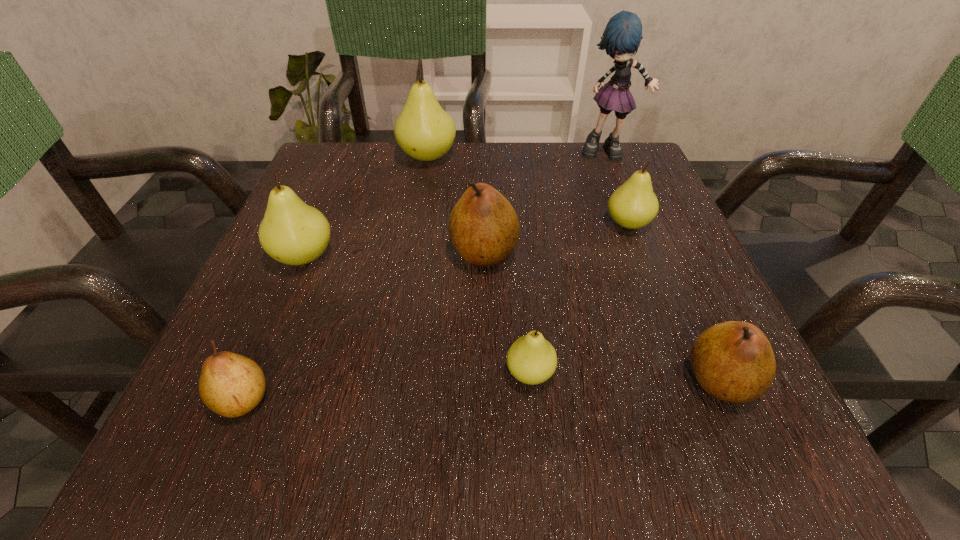
You are a GUI agent. You are given a task and a screenshot of the screen. Output one action in this format:
    pyautogui.click(x=<x>, y=<y>)
    Task: Click on the smallest green pear
    
    Given the screenshot: What is the action you would take?
    pyautogui.click(x=531, y=359)

Find the location of `the second green pear from right to left`. the second green pear from right to left is located at coordinates (531, 359).

The height and width of the screenshot is (540, 960). What are the coordinates of `vacant point located on the front-facing side of the blue rag doll` in the screenshot? It's located at (641, 230).

Locate an element on the screen. This screenshot has height=540, width=960. vacant space situated on the front of the biggest green pear is located at coordinates (413, 249).

You are a GUI agent. You are given a task and a screenshot of the screen. Output one action in this format:
    pyautogui.click(x=<x>, y=<y>)
    Task: Click on the free point located 0.090m on the front of the farthest brown pear
    The width and height of the screenshot is (960, 540).
    Given the screenshot: What is the action you would take?
    pyautogui.click(x=485, y=319)

Locate an element on the screen. The height and width of the screenshot is (540, 960). free spot located 0.180m on the front of the leftmost green pear is located at coordinates pos(256,373).

The width and height of the screenshot is (960, 540). What are the coordinates of `vacant space located on the back of the third biggest green pear` in the screenshot? It's located at pos(611,179).

Find the location of a particular element. The height and width of the screenshot is (540, 960). vacant position located 0.060m on the back of the rightmost brown pear is located at coordinates (692, 318).

Locate an element on the screen. free space located 0.400m on the back of the leftmost brown pear is located at coordinates (325, 202).

Identify the location of vacant position located 0.230m on the left of the smallest green pear. (337, 373).